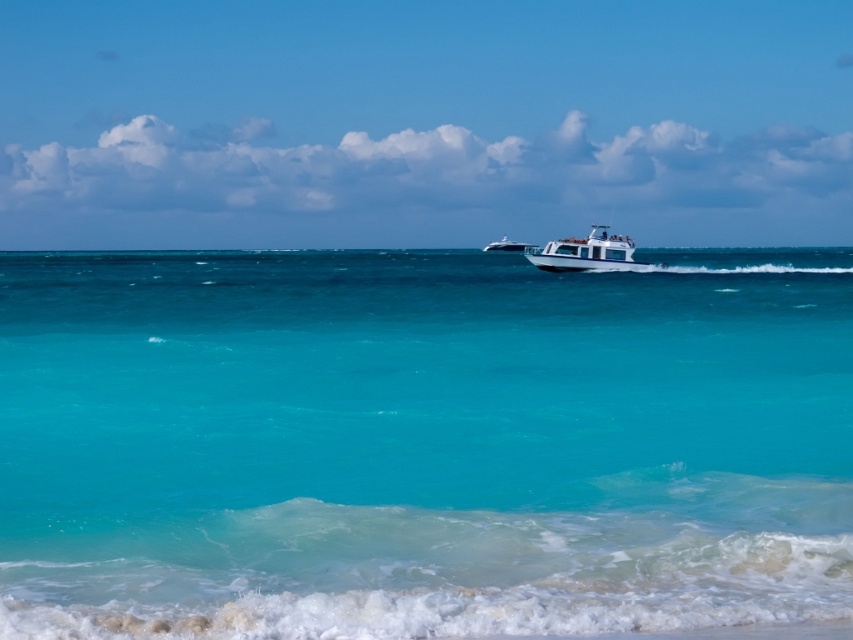
You are standing on the shore looking out at the coastal scene. There are two points marked in the image. Which point, point [187,323] or point [532,248], is closer to you?

Point [187,323] is closer to the viewer than point [532,248].

You are standing on the beach and see both the white glossy boat at center and the white glossy yacht at center. Which one appears nearer to you?

The white glossy boat at center is closer to the viewer than the white glossy yacht at center.

From the picture: You are a photographer standing on the shore and want to capture both the white glossy boat at center and the white glossy yacht at center in your shot. Which one is closer to the shore?

The white glossy boat at center is closer to the shore because it is located below the white glossy yacht at center, indicating it is positioned lower in the image which typically corresponds to being nearer to the viewer.